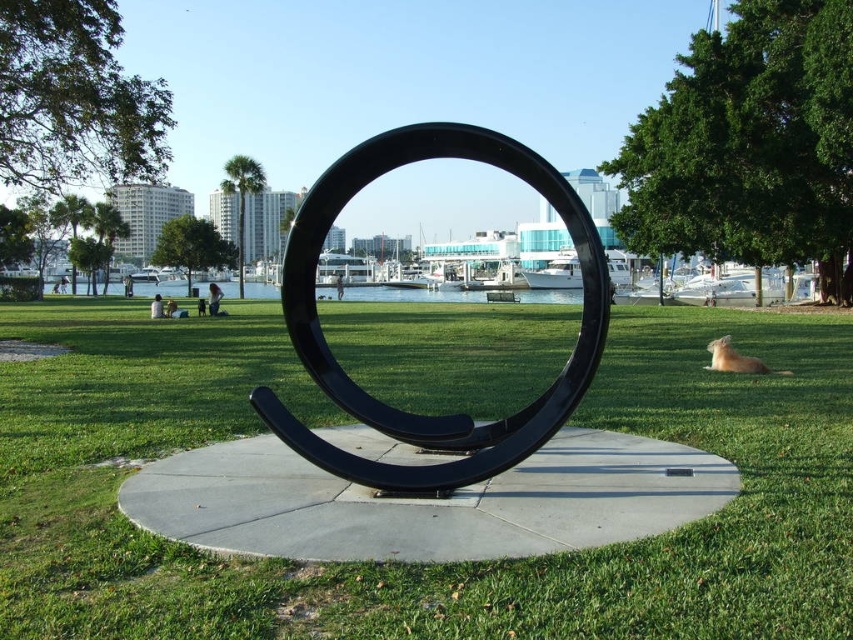
Question: Can you confirm if green grass at center is positioned to the left of black fabric person at center?

Choices:
 (A) no
 (B) yes

Answer: (A)

Question: Which point appears closest to the camera in this image?

Choices:
 (A) (218, 294)
 (B) (335, 282)

Answer: (A)

Question: Which is farther from the dark blue jeans at center?

Choices:
 (A) black matte horseshoe at center
 (B) black fabric person at center
 (C) green grass at center

Answer: (A)

Question: Can you confirm if dark blue jeans at center is thinner than black fabric person at center?

Choices:
 (A) yes
 (B) no

Answer: (A)

Question: Observing the image, what is the correct spatial positioning of dark blue jeans at center in reference to black fabric person at center?

Choices:
 (A) right
 (B) left

Answer: (B)

Question: Which of the following is the farthest from the observer?

Choices:
 (A) (693, 417)
 (B) (213, 314)
 (C) (341, 282)

Answer: (C)